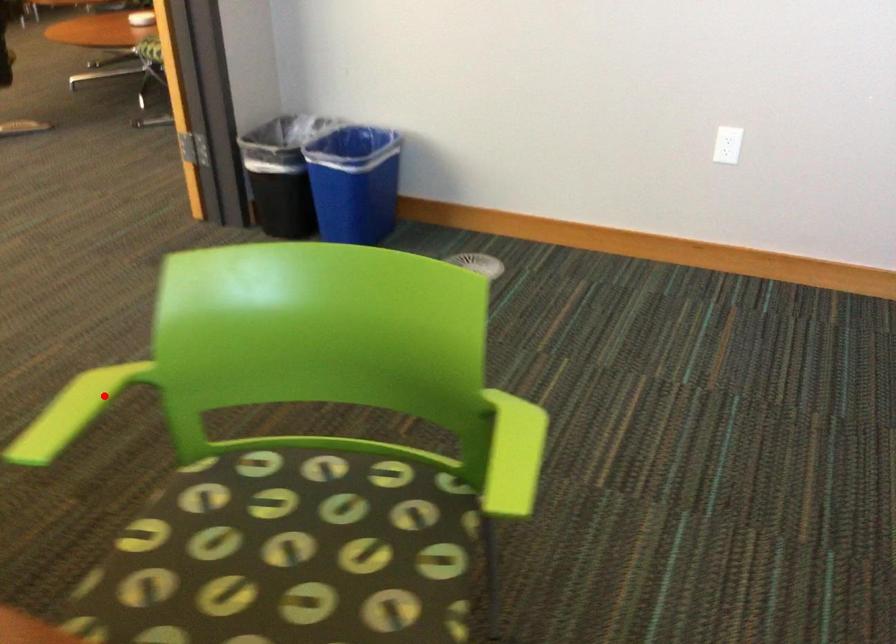
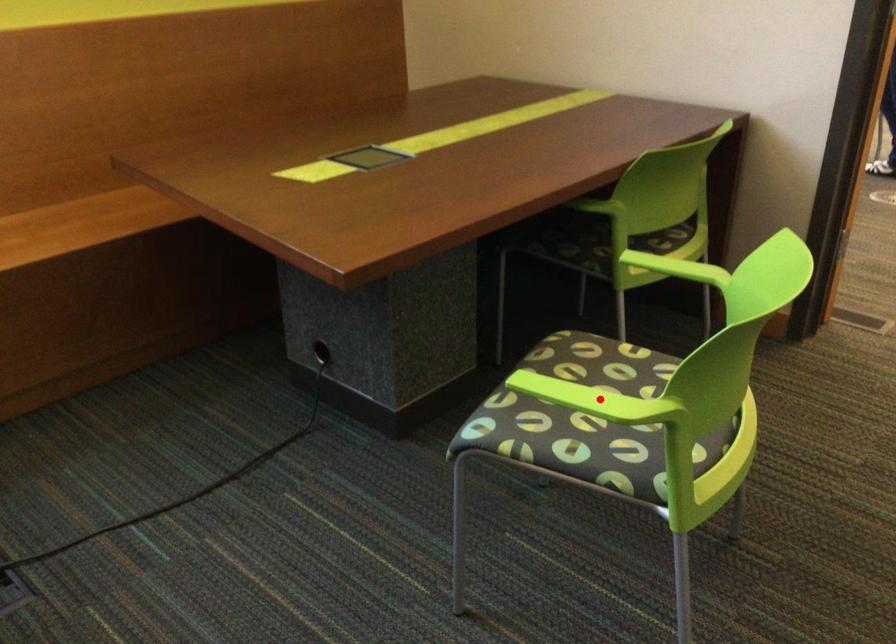
I am providing you with two images of the same scene from different viewpoints. A red point is marked on the first image and another point is marked on the second image. Is the marked point in image1 the same physical position as the marked point in image2?

No